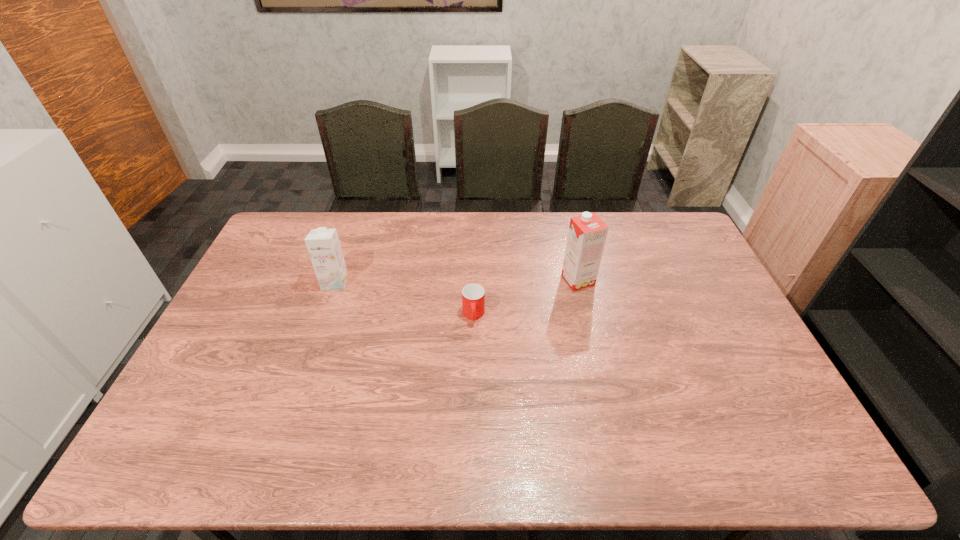
Locate an element on the screen. the rightmost object is located at coordinates (587, 234).

Where is `the right carton`? the right carton is located at coordinates (587, 234).

You are a GUI agent. You are given a task and a screenshot of the screen. Output one action in this format:
    pyautogui.click(x=<x>, y=<y>)
    Task: Click on the left carton
    The width and height of the screenshot is (960, 540).
    Given the screenshot: What is the action you would take?
    pyautogui.click(x=323, y=244)

Locate an element on the screen. the second shortest object is located at coordinates (323, 244).

The height and width of the screenshot is (540, 960). I want to click on cup, so click(473, 295).

In order to click on the shortest object in this screenshot , I will do tap(473, 295).

Locate an element on the screen. free space located on the front of the taller carton is located at coordinates (584, 304).

Identify the location of vacant region located on the left of the second tallest object. The width and height of the screenshot is (960, 540). (284, 282).

Image resolution: width=960 pixels, height=540 pixels. What are the coordinates of `vacant region located on the side of the nearest object with the handle` in the screenshot? It's located at [x=472, y=387].

In the image, there is a desktop. Where is `vacant space at the far edge`? This screenshot has width=960, height=540. vacant space at the far edge is located at coordinates point(499,240).